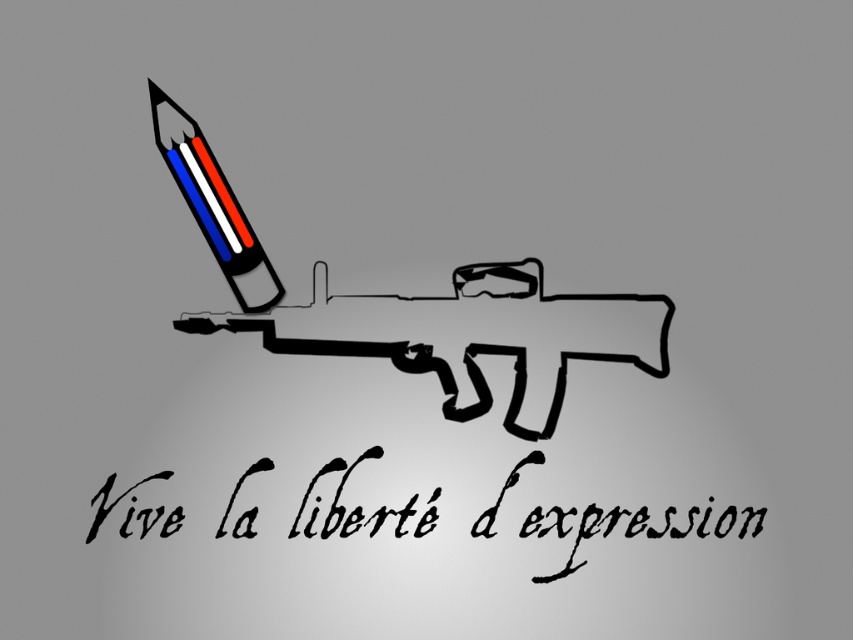
Question: Which point is farther from the camera taking this photo?

Choices:
 (A) (224, 225)
 (B) (514, 260)
 (C) (572, 548)

Answer: (B)

Question: Among these objects, which one is farthest from the camera?

Choices:
 (A) matte black gun at center
 (B) matte plastic pencil at upper left
 (C) black calligraphy at lower center

Answer: (A)

Question: Can you confirm if black calligraphy at lower center is wider than matte black gun at center?

Choices:
 (A) no
 (B) yes

Answer: (B)

Question: Is matte black gun at center positioned behind matte plastic pencil at upper left?

Choices:
 (A) no
 (B) yes

Answer: (B)

Question: Does black calligraphy at lower center appear over matte plastic pencil at upper left?

Choices:
 (A) no
 (B) yes

Answer: (A)

Question: Which point is closer to the camera taking this photo?

Choices:
 (A) (445, 392)
 (B) (194, 128)

Answer: (B)